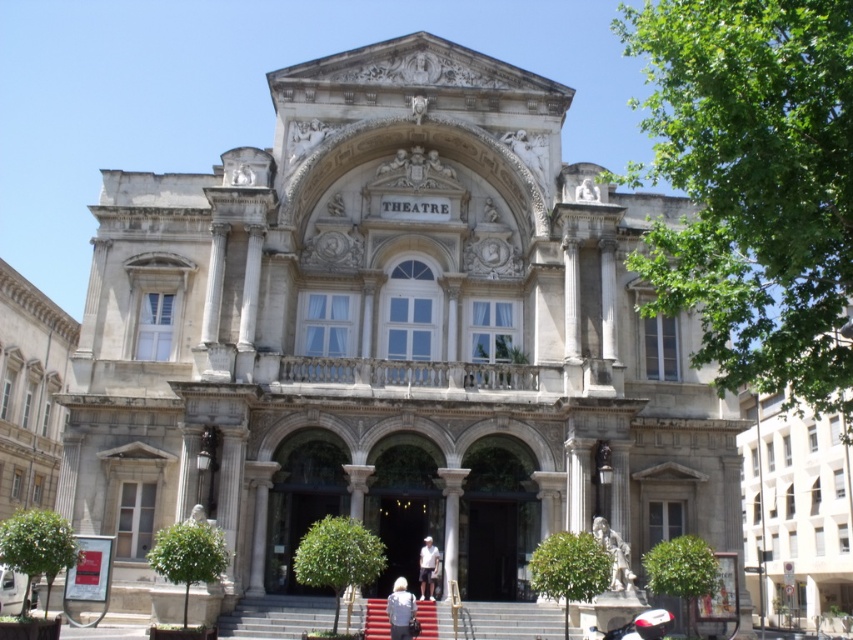
Between point (393, 496) and point (422, 588), which one is positioned behind?

Positioned behind is point (393, 496).

Is wooden door at center thinner than white cotton shirt at center?

In fact, wooden door at center might be wider than white cotton shirt at center.

Between point (434, 515) and point (421, 595), which one is positioned in front?

Point (421, 595) is more forward.

Locate an element on the screen. Image resolution: width=853 pixels, height=640 pixels. wooden door at center is located at coordinates (402, 532).

Is red carpeted stairs at center taller than red carpet at center?

Indeed, red carpeted stairs at center has a greater height compared to red carpet at center.

Between point (451, 636) and point (431, 611), which one is positioned behind?

Positioned behind is point (431, 611).

What are the coordinates of `red carpeted stairs at center` in the screenshot? It's located at (276, 616).

This screenshot has width=853, height=640. Find the location of `red carpeted stairs at center`. red carpeted stairs at center is located at coordinates (276, 616).

Is red carpeted stairs at center smaller than wooden door at center?

Actually, red carpeted stairs at center might be larger than wooden door at center.

Does red carpeted stairs at center have a greater height compared to wooden door at center?

In fact, red carpeted stairs at center may be shorter than wooden door at center.

Which is behind, point (379, 604) or point (381, 522)?

Positioned behind is point (381, 522).

In order to click on red carpeted stairs at center in this screenshot , I will do `click(276, 616)`.